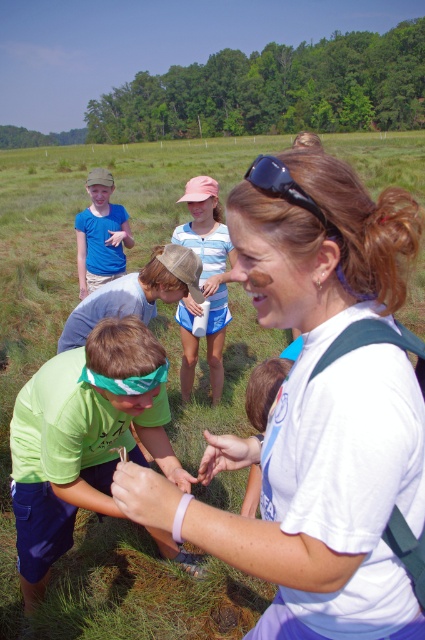
Which of these two, green fabric headband at lower left or pink fabric cap at upper center, stands shorter?

green fabric headband at lower left is shorter.

Who is more forward, (23, 442) or (180, 198)?

Point (23, 442) is in front.

The height and width of the screenshot is (640, 425). What are the coordinates of `green fabric headband at lower left` in the screenshot? It's located at (84, 438).

Consider the image. Does green fabric headband at lower left have a larger size compared to matte blue shirt at upper left?

Yes, green fabric headband at lower left is bigger than matte blue shirt at upper left.

Does point (78, 401) come in front of point (90, 227)?

That is True.

Who is more forward, (56, 426) or (110, 236)?

Point (56, 426)

The image size is (425, 640). I want to click on green fabric headband at lower left, so click(x=84, y=438).

Between point (257, 396) and point (303, 202), which one is positioned behind?

The point (257, 396) is more distant.

Does green fabric shirt at center have a smaller size compared to black rubber sunglasses at upper center?

Actually, green fabric shirt at center might be larger than black rubber sunglasses at upper center.

At what (x,y) coordinates should I click in order to perform the action: click on green fabric shirt at center. Please return your answer as a coordinate pair (x, y). The width and height of the screenshot is (425, 640). Looking at the image, I should click on (263, 388).